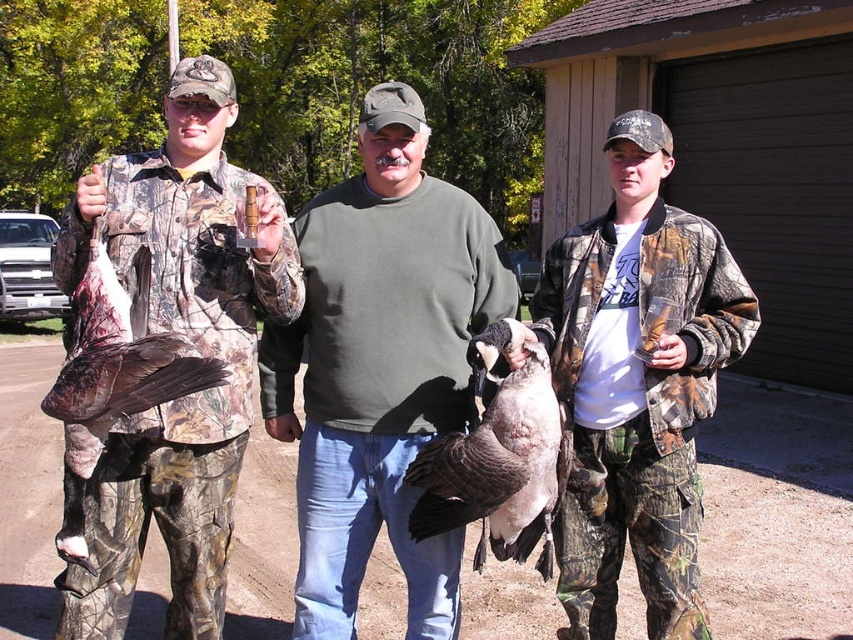
Which is above, camouflage jacket at left or brown camo duck at left?

camouflage jacket at left is higher up.

Which of these two, camouflage jacket at left or brown camo duck at left, stands taller?

camouflage jacket at left

Describe the element at coordinates (192, 344) in the screenshot. This screenshot has height=640, width=853. I see `camouflage jacket at left` at that location.

The height and width of the screenshot is (640, 853). What are the coordinates of `camouflage jacket at left` in the screenshot? It's located at (192, 344).

Does dark brown feathers at center have a smaller size compared to brown camo duck at left?

Correct, dark brown feathers at center occupies less space than brown camo duck at left.

Is dark brown feathers at center taller than brown camo duck at left?

Incorrect, dark brown feathers at center's height is not larger of brown camo duck at left's.

Who is more forward, (432,451) or (164,378)?

Point (164,378) is more forward.

The width and height of the screenshot is (853, 640). What are the coordinates of `dark brown feathers at center` in the screenshot? It's located at (x=497, y=470).

Is point (291, 355) closer to viewer compared to point (747, 339)?

No, (291, 355) is behind (747, 339).

Is green cotton sweater at center wider than camo jacket at center?

Correct, the width of green cotton sweater at center exceeds that of camo jacket at center.

Locate an element on the screen. This screenshot has height=640, width=853. green cotton sweater at center is located at coordinates (380, 365).